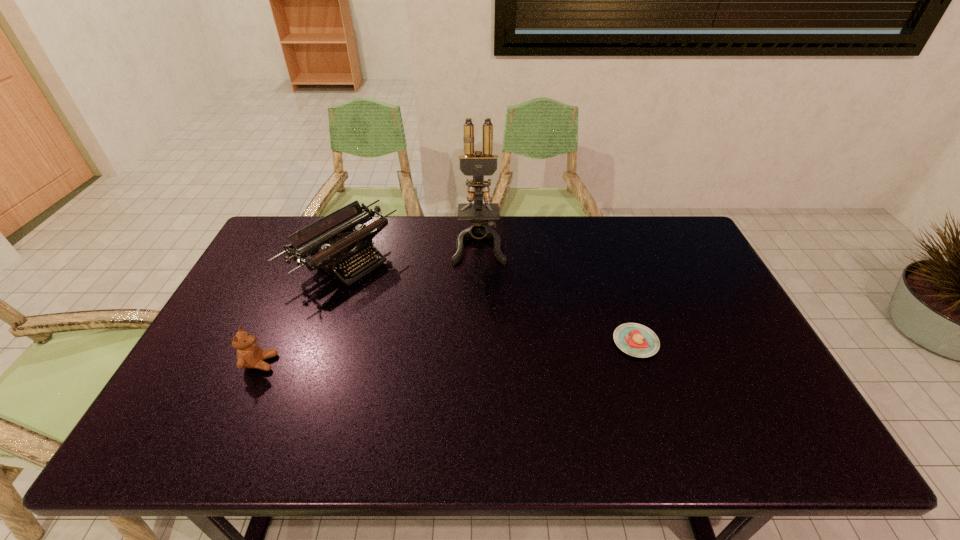
Find the location of a particular element. blank region between the third shortest object and the third object from left to right is located at coordinates [x=412, y=251].

At what (x,y) coordinates should I click in order to perform the action: click on free space between the teddy bear and the third object from left to right. Please return your answer as a coordinate pair (x, y). The width and height of the screenshot is (960, 540). Looking at the image, I should click on (370, 303).

I want to click on vacant point located between the second tallest object and the tallest object, so click(x=412, y=251).

Image resolution: width=960 pixels, height=540 pixels. Identify the location of free space between the third shortest object and the pastry. (490, 301).

I want to click on object that ranks as the closest to the microscope, so click(341, 246).

At what (x,y) coordinates should I click in order to perform the action: click on object that stands as the closest to the third tallest object. Please return your answer as a coordinate pair (x, y). Looking at the image, I should click on (341, 246).

Locate an element on the screen. The width and height of the screenshot is (960, 540). vacant point that satisfies the following two spatial constraints: 1. on the front side of the shortest object; 2. on the left side of the typewriter is located at coordinates [314, 342].